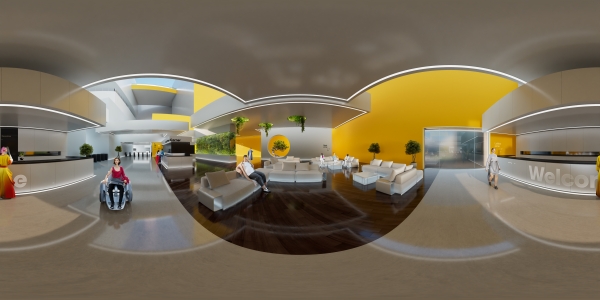
Identify the location of chair. Image resolution: width=600 pixels, height=300 pixels. (345, 166).